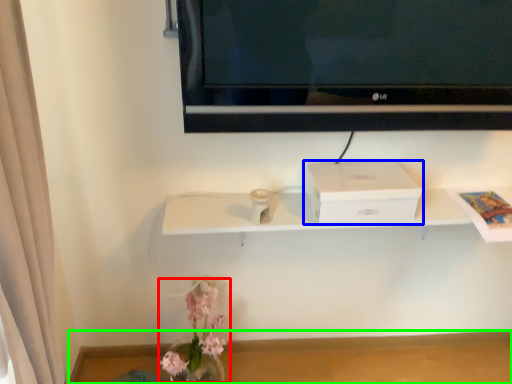
Question: Considering the real-world distances, which object is farthest from floral arrangement (highlighted by a red box)? box (highlighted by a blue box) or table (highlighted by a green box)?

Choices:
 (A) box
 (B) table

Answer: (A)